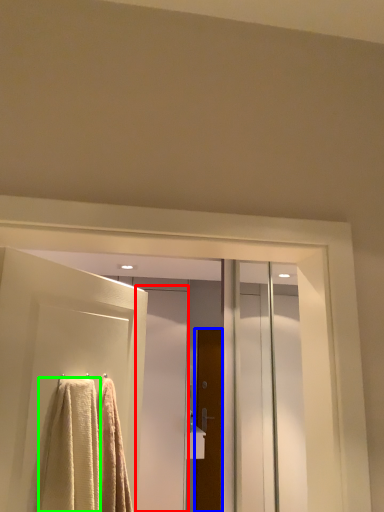
Question: Estimate the real-world distances between objects in this image. Which object is closer to screen door (highlighted by a red box), door (highlighted by a blue box) or towel (highlighted by a green box)?

Choices:
 (A) door
 (B) towel

Answer: (A)